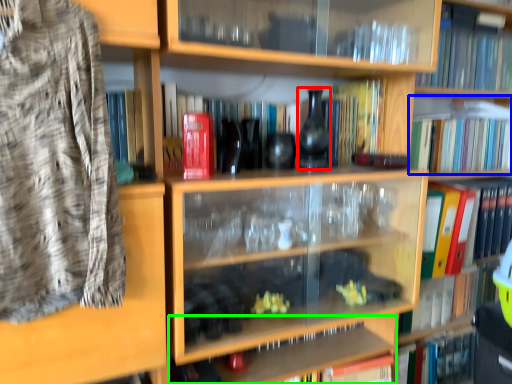
Question: Estimate the real-world distances between objects in this image. Which object is farther from glass vase (highlighted by a red box), book (highlighted by a blue box) or cabinet (highlighted by a green box)?

Choices:
 (A) book
 (B) cabinet

Answer: (A)